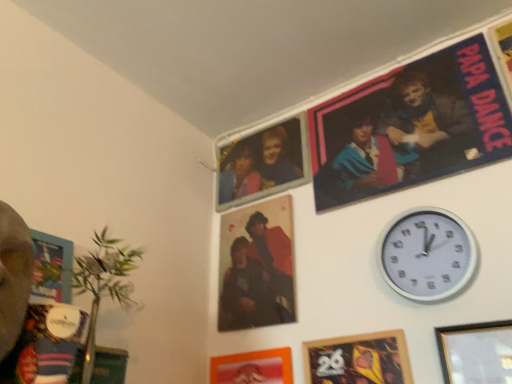
Question: Could you tell me if matte blue fabric poster at upper right is facing white plastic wall clock at upper right?

Choices:
 (A) yes
 (B) no

Answer: (B)

Question: Is matte blue fabric poster at upper right taller than white plastic wall clock at upper right?

Choices:
 (A) no
 (B) yes

Answer: (B)

Question: Is matte blue fabric poster at upper right smaller than white plastic wall clock at upper right?

Choices:
 (A) no
 (B) yes

Answer: (A)

Question: Can white plastic wall clock at upper right be found inside matte blue fabric poster at upper right?

Choices:
 (A) yes
 (B) no

Answer: (B)

Question: From the image's perspective, is matte blue fabric poster at upper right under white plastic wall clock at upper right?

Choices:
 (A) no
 (B) yes

Answer: (A)

Question: From the image's perspective, is matte blue fabric poster at upper right above white plastic wall clock at upper right?

Choices:
 (A) no
 (B) yes

Answer: (B)

Question: Considering the relative sizes of wooden picture frame at lower right, the third picture frame positioned from the left, and matte plastic photo frame at upper center in the image provided, is wooden picture frame at lower right, the third picture frame positioned from the left, thinner than matte plastic photo frame at upper center?

Choices:
 (A) yes
 (B) no

Answer: (A)

Question: Is wooden picture frame at lower right, placed as the 1th picture frame when sorted from right to left, located outside matte plastic photo frame at upper center?

Choices:
 (A) yes
 (B) no

Answer: (A)

Question: Can you confirm if wooden picture frame at lower right, placed as the 1th picture frame when sorted from right to left, is positioned to the right of matte plastic photo frame at upper center?

Choices:
 (A) no
 (B) yes

Answer: (B)

Question: Is wooden picture frame at lower right, placed as the 1th picture frame when sorted from right to left, oriented away from matte plastic photo frame at upper center?

Choices:
 (A) no
 (B) yes

Answer: (A)

Question: Does wooden picture frame at lower right, the third picture frame positioned from the left, have a smaller size compared to matte plastic photo frame at upper center?

Choices:
 (A) yes
 (B) no

Answer: (A)

Question: Would you say matte blue fabric poster at upper right is outside wooden framed poster at lower center, acting as the second picture frame starting from the right?

Choices:
 (A) no
 (B) yes

Answer: (B)